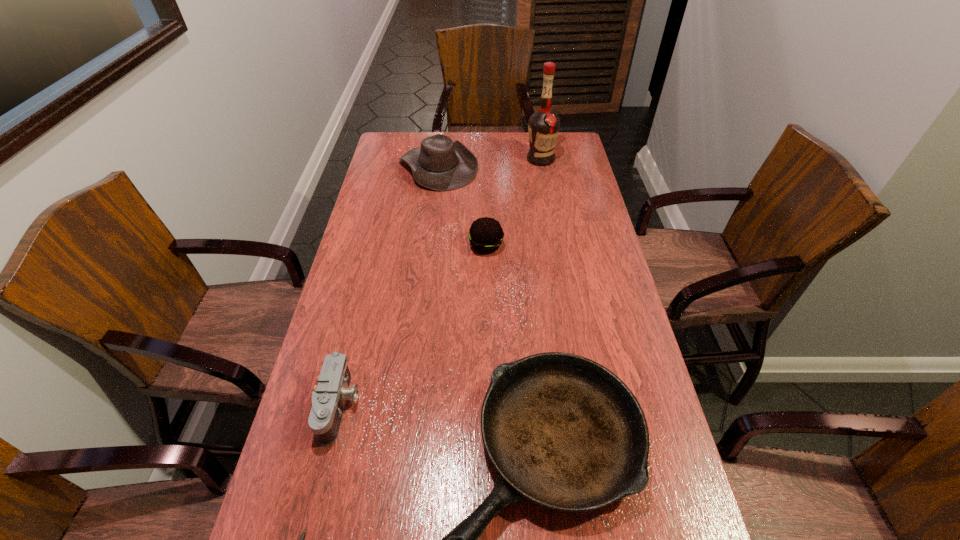
Locate an element on the screen. This screenshot has width=960, height=540. liquor is located at coordinates (543, 126).

Where is `cowboy hat`? This screenshot has width=960, height=540. cowboy hat is located at coordinates (441, 164).

You are a GUI agent. You are given a task and a screenshot of the screen. Output one action in this format:
    pyautogui.click(x=<x>, y=<y>)
    Task: Click on the third farthest object
    The width and height of the screenshot is (960, 540).
    Given the screenshot: What is the action you would take?
    pyautogui.click(x=485, y=234)

This screenshot has width=960, height=540. What are the coordinates of `camera` in the screenshot? It's located at (329, 397).

Locate an element on the screen. The image size is (960, 540). vacant area located on the front and back of the liquor is located at coordinates (543, 177).

At what (x,y) coordinates should I click in order to perform the action: click on vacant space located 0.380m on the right of the second tallest object. Please return your answer as a coordinate pair (x, y). Image resolution: width=960 pixels, height=540 pixels. Looking at the image, I should click on (570, 166).

The width and height of the screenshot is (960, 540). What are the coordinates of `free spot located 0.050m on the back of the fourth nearest object` in the screenshot? It's located at (486, 225).

The image size is (960, 540). In order to click on vacant region located on the lens of the camera in this screenshot , I will do `click(436, 406)`.

I want to click on liquor that is at the far edge, so click(543, 126).

Find the location of a particular element. This screenshot has height=540, width=960. cowboy hat situated at the far edge is located at coordinates (441, 164).